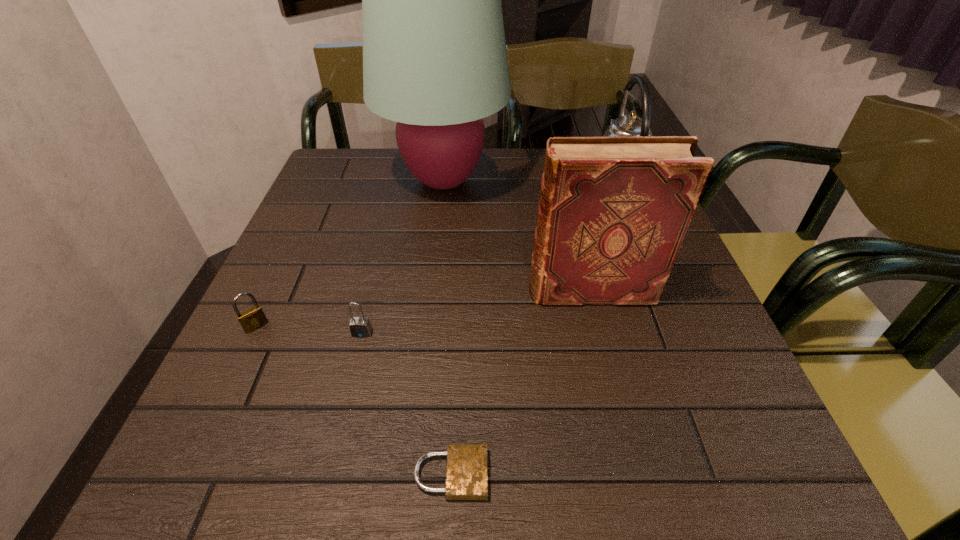
Where is `object located at the left edge`? Image resolution: width=960 pixels, height=540 pixels. object located at the left edge is located at coordinates (254, 318).

You are a GUI agent. You are given a task and a screenshot of the screen. Output one action in this format:
    pyautogui.click(x=<x>, y=<y>)
    Task: Click on the hardback book that is positioned at the right edge
    
    Given the screenshot: What is the action you would take?
    pyautogui.click(x=613, y=213)

Locate an element on the screen. kettle present at the right edge is located at coordinates (626, 125).

Where is `object present at the far right corner`? The height and width of the screenshot is (540, 960). object present at the far right corner is located at coordinates (626, 125).

You are a GUI agent. You are given a task and a screenshot of the screen. Output one action in this format:
    pyautogui.click(x=<x>, y=<y>)
    Task: Click on the vacant space at the far edge of the desktop
    The width and height of the screenshot is (960, 540).
    Given the screenshot: What is the action you would take?
    pyautogui.click(x=396, y=166)

Identify the location of vacant area at the near edge. (631, 489).

The image size is (960, 540). What are the coordinates of `free location at the left edge` in the screenshot? It's located at (257, 421).

Identify the location of free space at the far left corner of the desktop. This screenshot has height=540, width=960. (311, 193).

The height and width of the screenshot is (540, 960). What are the coordinates of `vacant space that's between the leftmost padlock and the lampshade` in the screenshot? It's located at (350, 253).

This screenshot has height=540, width=960. Find the location of `unoccupied position between the tallest object and the nearest padlock`. unoccupied position between the tallest object and the nearest padlock is located at coordinates click(x=447, y=327).